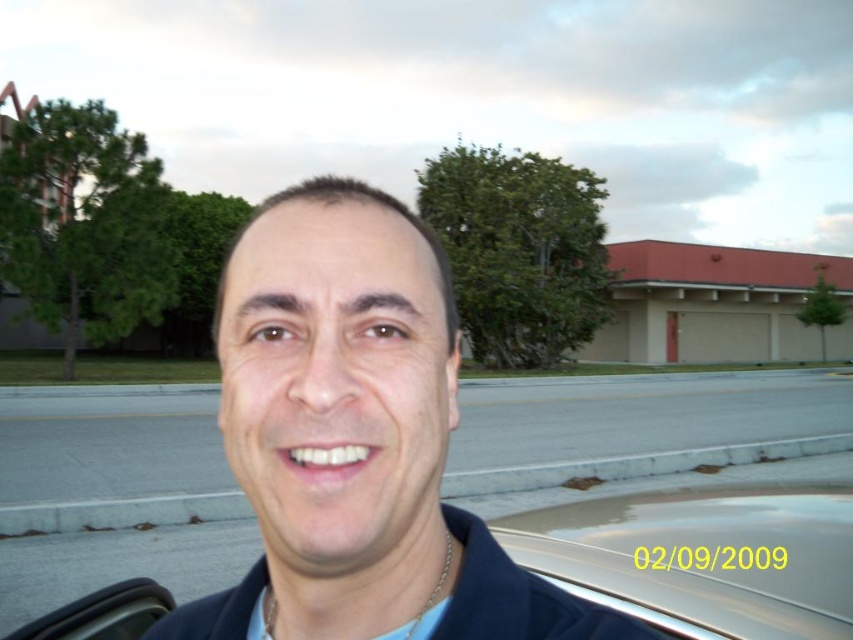
Question: Does blue fabric shirt at center appear over clear glass car window at lower right?

Choices:
 (A) no
 (B) yes

Answer: (B)

Question: Considering the real-world distances, which object is closest to the blue fabric shirt at center?

Choices:
 (A) clear glass car window at lower right
 (B) blue cotton shirt at center
 (C) gold metallic car at lower center

Answer: (B)

Question: Which object appears closest to the camera in this image?

Choices:
 (A) clear glass car window at lower right
 (B) blue cotton shirt at center
 (C) blue fabric shirt at center
 (D) gold metallic car at lower center

Answer: (C)

Question: From the image, what is the correct spatial relationship of blue fabric shirt at center in relation to blue cotton shirt at center?

Choices:
 (A) left
 (B) right

Answer: (A)

Question: Which of these objects is positioned farthest from the gold metallic car at lower center?

Choices:
 (A) blue cotton shirt at center
 (B) clear glass car window at lower right

Answer: (A)

Question: Does clear glass car window at lower right appear under blue cotton shirt at center?

Choices:
 (A) no
 (B) yes

Answer: (B)